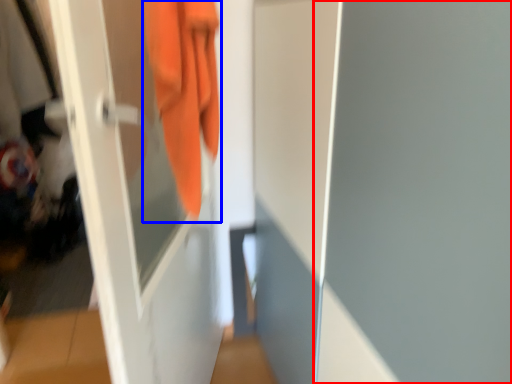
Question: Which point is closer to the camera, screen door (highlighted by a red box) or towel (highlighted by a blue box)?

Choices:
 (A) screen door
 (B) towel

Answer: (A)